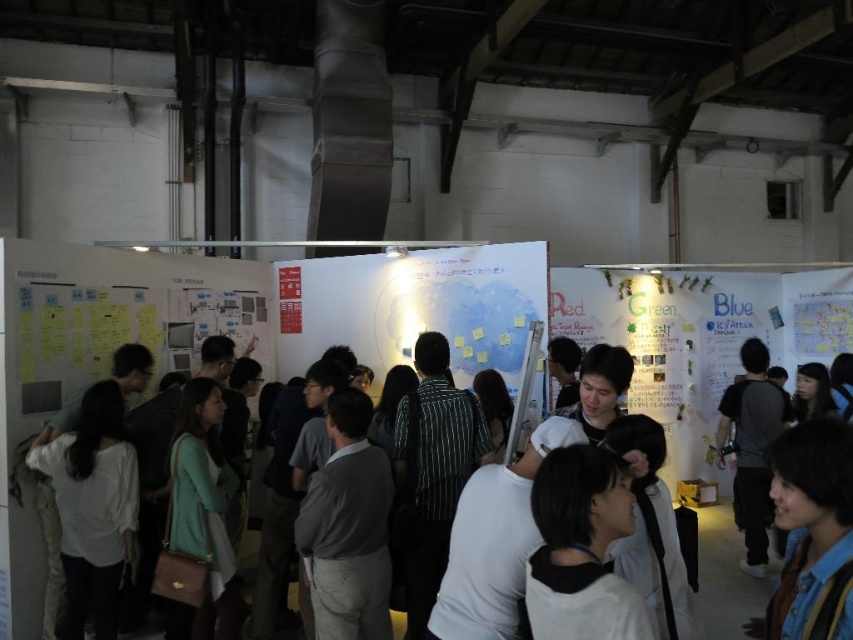
You are standing in the workshop and see two points marked on the wall. The first is at coordinates point (373,349) and the second is at point (733,324). Which point is closer to you?

Point (373,349) is closer to the viewer than point .508, 0.860.

You are organizing a presentation and need to know which poster is wider. You have a white matte poster at center and a green matte poster at center. Which one is wider?

The green matte poster at center is wider than the white matte poster at center because the white matte poster at center has a smaller width according to the description.